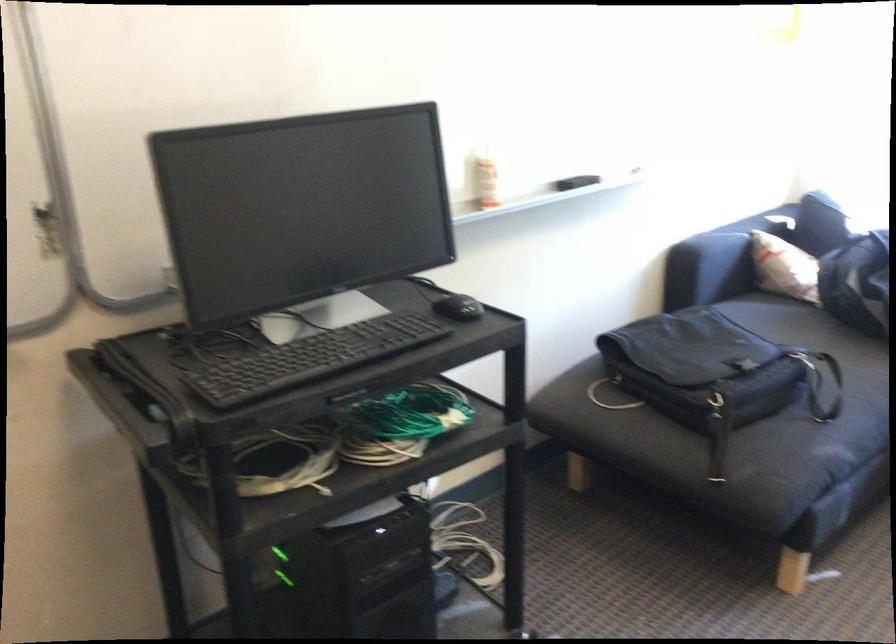
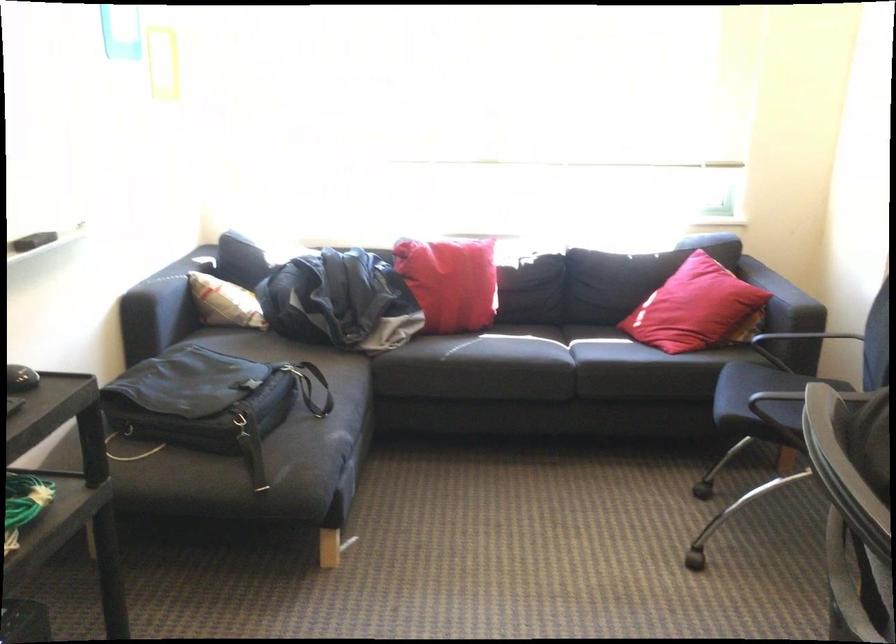
Question: The first image is from the beginning of the video and the second image is from the end. How did the camera likely rotate when shooting the video?

Choices:
 (A) Left
 (B) Right
 (C) Up
 (D) Down

Answer: (B)